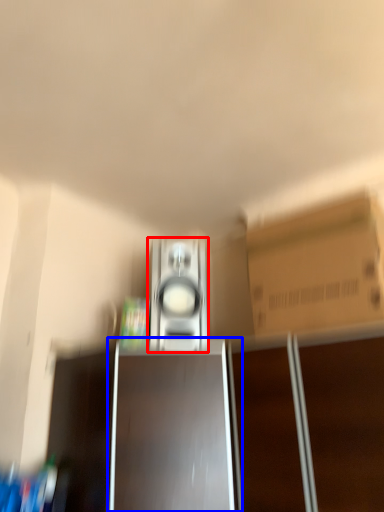
Question: Which of the following is the closest to the observer, home appliance (highlighted by a red box) or cabinetry (highlighted by a blue box)?

Choices:
 (A) home appliance
 (B) cabinetry

Answer: (B)